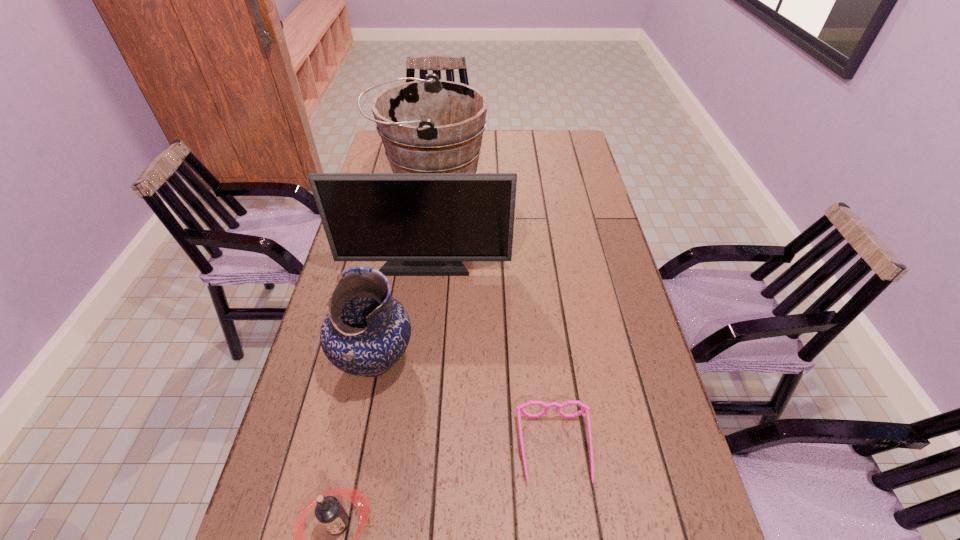
Identify the location of bucket present at the left edge. (427, 126).

Image resolution: width=960 pixels, height=540 pixels. What are the coordinates of `monitor that is at the left edge` in the screenshot? It's located at (423, 224).

At what (x,y) coordinates should I click in order to perform the action: click on pottery that is at the left edge. Please return your answer as a coordinate pair (x, y). Image resolution: width=960 pixels, height=540 pixels. Looking at the image, I should click on (366, 331).

Identify the location of object present at the far left corner. click(427, 126).

The height and width of the screenshot is (540, 960). I want to click on free location at the left edge of the desktop, so click(x=320, y=368).

Locate an element on the screen. free region at the right edge is located at coordinates (603, 443).

Identify the location of blank space at the far right corner. (550, 137).

Locate an element on the screen. Image resolution: width=960 pixels, height=540 pixels. vacant area between the pottery and the fourth farthest object is located at coordinates coord(465,404).

This screenshot has height=540, width=960. I want to click on free point between the farthest object and the second nearest object, so click(x=492, y=317).

This screenshot has width=960, height=540. In order to click on vacant space in between the shortest object and the third tallest object in this screenshot , I will do `click(465, 404)`.